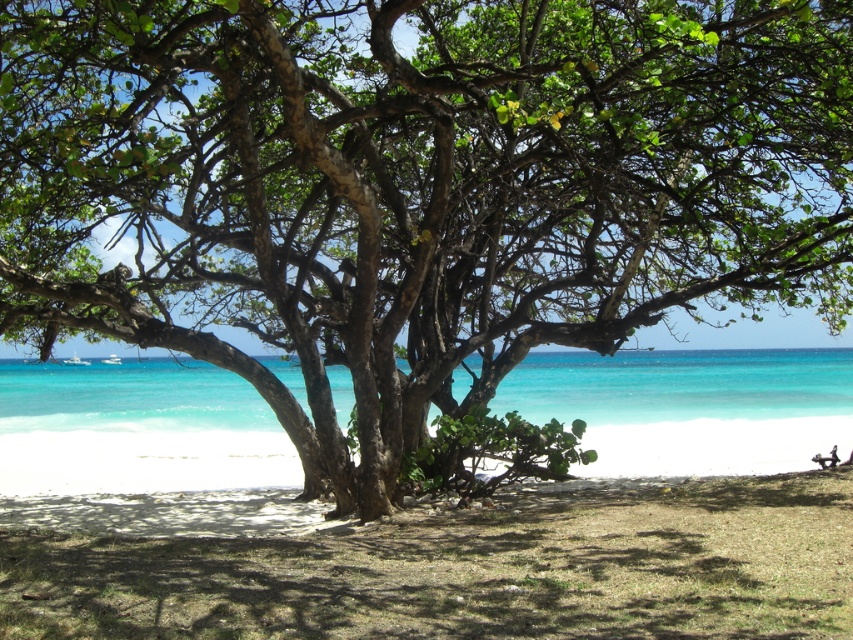
Is brown sand at center thinner than turquoise water at center?

Correct, brown sand at center's width is less than turquoise water at center's.

Based on the photo, who is shorter, brown sand at center or turquoise water at center?

With less height is brown sand at center.

Between point (224, 582) and point (157, 420), which one is positioned behind?

The point (157, 420) is more distant.

The image size is (853, 640). Find the location of `brown sand at center`. brown sand at center is located at coordinates (469, 570).